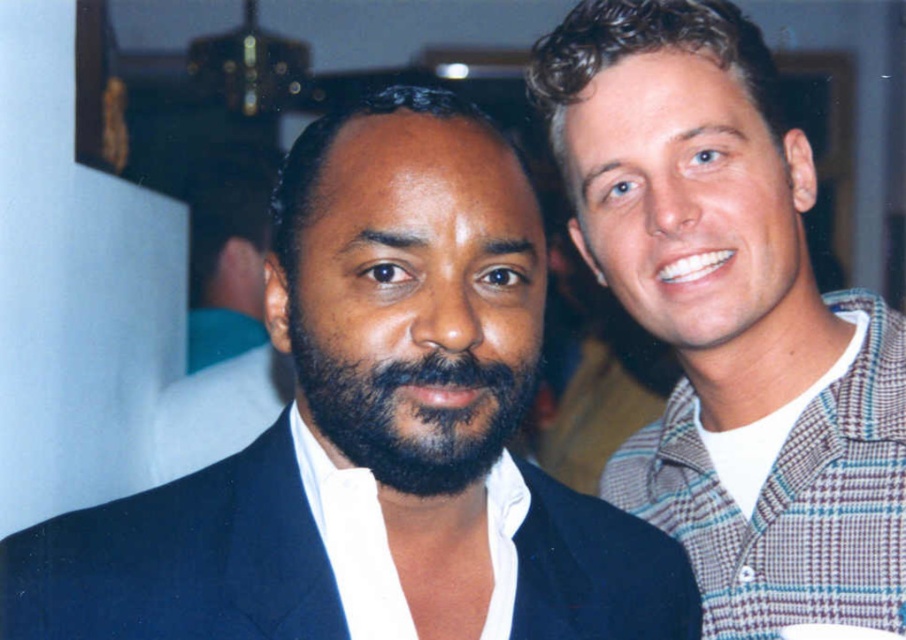
You are at a social gathering and want to take a photo of both individuals. The camera you are using has a limited depth of field. Which point should you focus on to ensure both the point at (759, 118) and the point at (407, 365) are in focus?

You should focus on the point at (407, 365) because it is closer to the camera than the point at (759, 118). By focusing on the closer point, the depth of field will extend backward to include the farther point as well.

You are standing in the room and want to locate the dark blue suit at center. According to the coordinates provided, what are the exact coordinates where you should look to find it?

The dark blue suit at center is located at the coordinates point (373, 435).